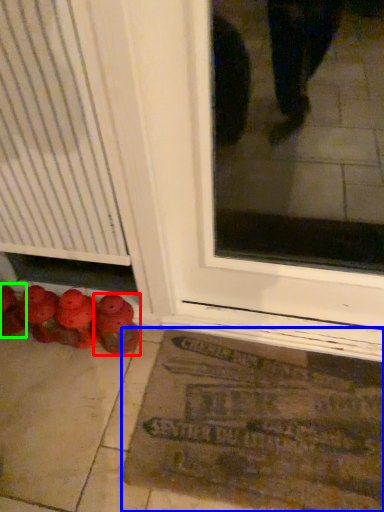
Question: Estimate the real-world distances between objects in this image. Which object is closer to footwear (highlighted by a red box), bath mat (highlighted by a blue box) or footwear (highlighted by a green box)?

Choices:
 (A) bath mat
 (B) footwear

Answer: (B)